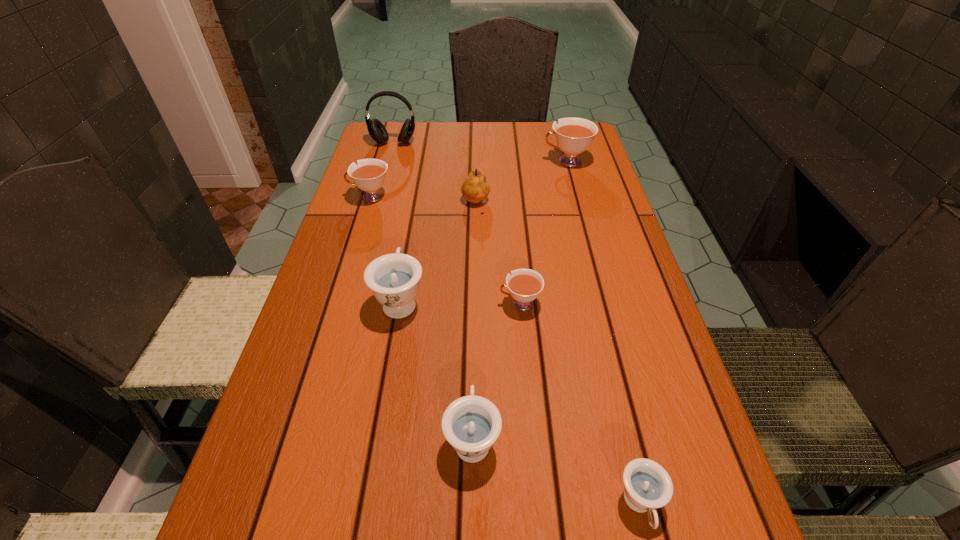
Find the location of `vacant area between the pear and the tallest object`. vacant area between the pear and the tallest object is located at coordinates (435, 173).

I want to click on unoccupied area between the leftmost blue teacup and the nearest white teacup, so click(461, 302).

You are a GUI agent. You are given a task and a screenshot of the screen. Output one action in this format:
    pyautogui.click(x=<x>, y=<y>)
    Task: Click on the free space between the rightmost white teacup and the pear
    
    Given the screenshot: What is the action you would take?
    pyautogui.click(x=521, y=183)

You are a GUI agent. You are given a task and a screenshot of the screen. Output one action in this format:
    pyautogui.click(x=<x>, y=<y>)
    Task: Click on the free point between the third teacup from left to right and the smallest blue teacup
    
    Given the screenshot: What is the action you would take?
    pyautogui.click(x=556, y=471)

Select which object appears as the seventh closest to the second blue teacup from left to right. Please provide its 2D coordinates. Your answer should be formatted as a tuple, i.e. [(x, y)], where the tuple contains the x and y coordinates of a point satisfying the conditions above.

[(377, 131)]

Choose which object is the fourth nearest neighbor to the fourth teacup from right to left. Please provide its 2D coordinates. Your answer should be formatted as a tuple, i.e. [(x, y)], where the tuple contains the x and y coordinates of a point satisfying the conditions above.

[(475, 188)]

At what (x,y) coordinates should I click in order to perform the action: click on the fourth closest teacup to the second smallest blue teacup. Please return your answer as a coordinate pair (x, y). The image size is (960, 540). Looking at the image, I should click on (369, 176).

Image resolution: width=960 pixels, height=540 pixels. Find the location of `teacup that is the third closest to the smallest blue teacup`. teacup that is the third closest to the smallest blue teacup is located at coordinates (394, 278).

This screenshot has width=960, height=540. What are the coordinates of `white teacup that stands as the third closest to the farthest blue teacup` in the screenshot? It's located at (573, 135).

Locate which white teacup is the second closest to the leftmost white teacup. Please provide its 2D coordinates. Your answer should be formatted as a tuple, i.e. [(x, y)], where the tuple contains the x and y coordinates of a point satisfying the conditions above.

[(573, 135)]